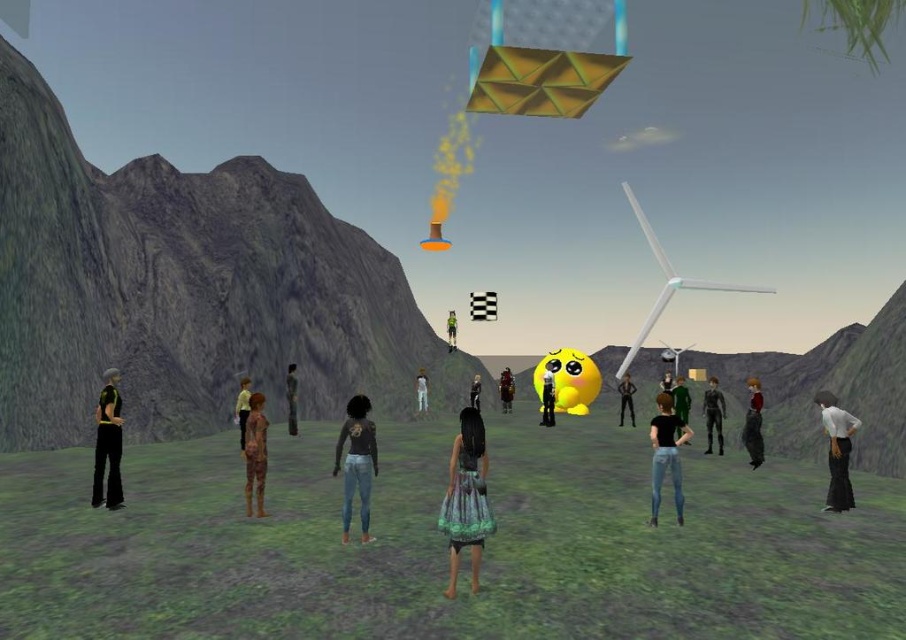
Consider the image. Measure the distance from printed fabric dress at center to white matte pants at center.

51.13 feet

Which is more to the left, printed fabric dress at center or white matte pants at center?

white matte pants at center is more to the left.

The image size is (906, 640). I want to click on printed fabric dress at center, so click(x=466, y=499).

Is point (820, 403) more distant than point (447, 321)?

No, it is in front of (447, 321).

Can you confirm if white matte dress at lower right is wider than green fabric shirt at center?

Indeed, white matte dress at lower right has a greater width compared to green fabric shirt at center.

Is point (825, 428) positioned after point (456, 321)?

No, it is not.

The height and width of the screenshot is (640, 906). In order to click on white matte dress at lower right in this screenshot , I will do `click(837, 451)`.

Does printed fabric dress at center appear over brown fabric dress at center?

Correct, printed fabric dress at center is located above brown fabric dress at center.

Does printed fabric dress at center appear on the left side of brown fabric dress at center?

Incorrect, printed fabric dress at center is not on the left side of brown fabric dress at center.

Who is more distant from viewer, (453, 556) or (288, 426)?

Positioned behind is point (288, 426).

Image resolution: width=906 pixels, height=640 pixels. In order to click on printed fabric dress at center in this screenshot , I will do pyautogui.click(x=466, y=499).